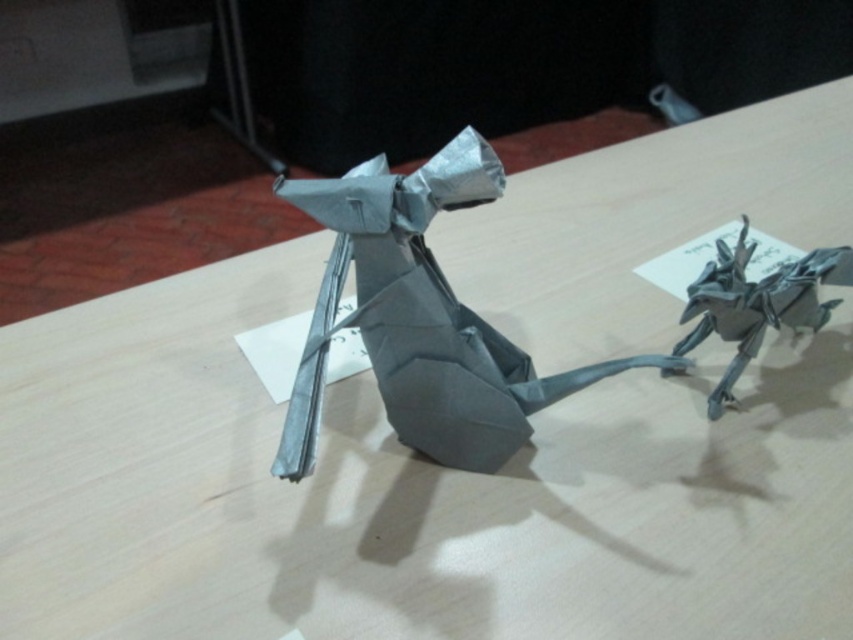
Question: Among these points, which one is nearest to the camera?

Choices:
 (A) (811, 310)
 (B) (427, 172)

Answer: (B)

Question: Does gray paper origami mouse at center have a lesser width compared to matte gray origami at right?

Choices:
 (A) no
 (B) yes

Answer: (A)

Question: Which object appears farthest from the camera in this image?

Choices:
 (A) gray metallic origami dragon at right
 (B) gray paper at center
 (C) gray paper origami mouse at center

Answer: (A)

Question: Which point is farther to the camera?

Choices:
 (A) gray metallic origami dragon at right
 (B) gray paper at center
 (C) matte gray origami at right

Answer: (C)

Question: From the image, what is the correct spatial relationship of gray metallic origami dragon at right in relation to matte gray origami at right?

Choices:
 (A) right
 (B) left

Answer: (A)

Question: Does gray metallic origami dragon at right appear under matte gray origami at right?

Choices:
 (A) yes
 (B) no

Answer: (A)